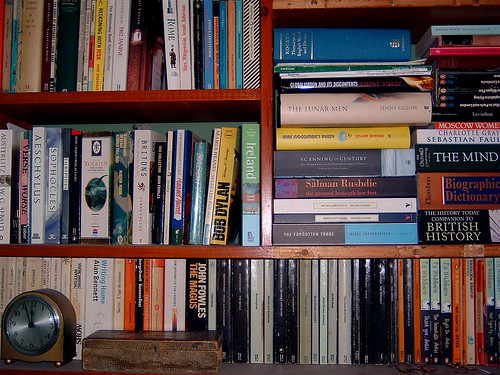
Locate an element on the screen. The width and height of the screenshot is (500, 375). shelves is located at coordinates (75, 367), (232, 251), (146, 96), (331, 4).